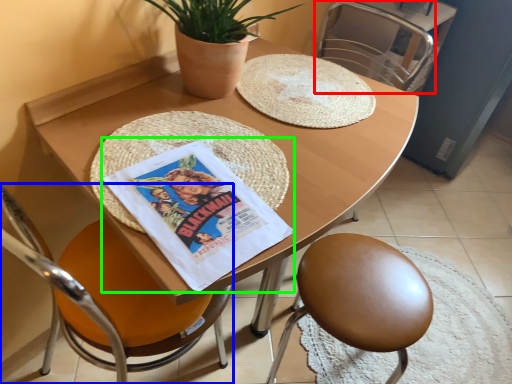
Question: Which object is the farthest from chair (highlighted by a red box)? Choose among these: chair (highlighted by a blue box) or comic book (highlighted by a green box).

Choices:
 (A) chair
 (B) comic book

Answer: (A)